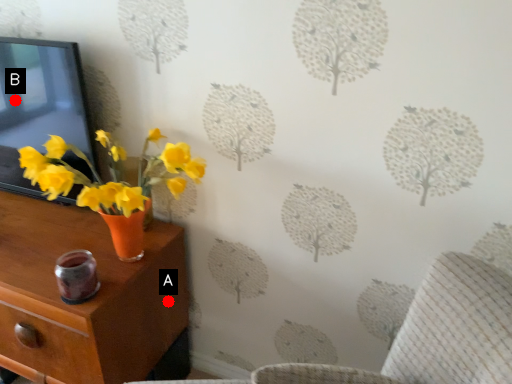
Question: Two points are circled on the image, labeled by A and B beside each circle. Among these points, which one is nearest to the camera?

Choices:
 (A) A is closer
 (B) B is closer

Answer: (B)